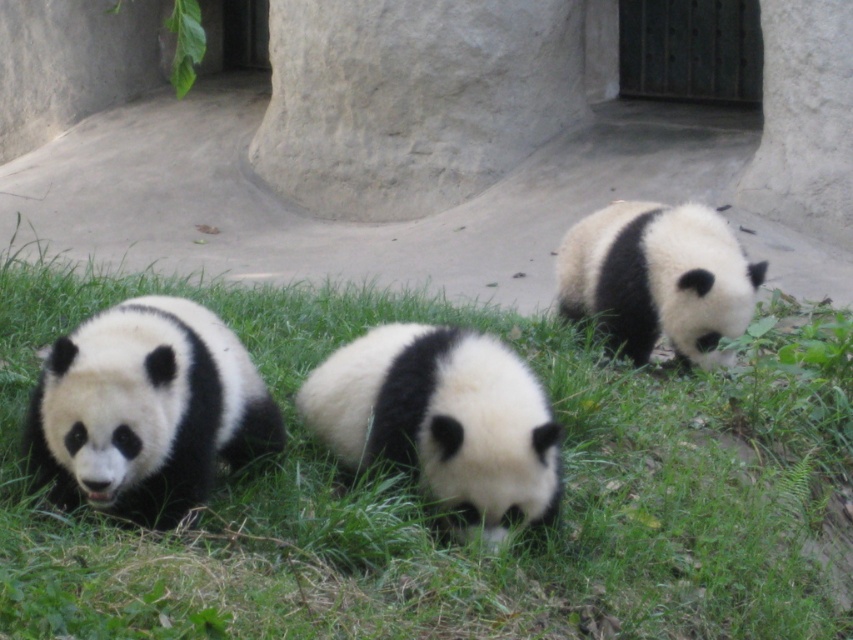
In the scene shown: You are a zookeeper trying to locate the white soft fur panda at center in the enclosure. Based on the coordinates provided, where exactly should you look to find it?

The white soft fur panda at center is located at the coordinates point (442, 420).